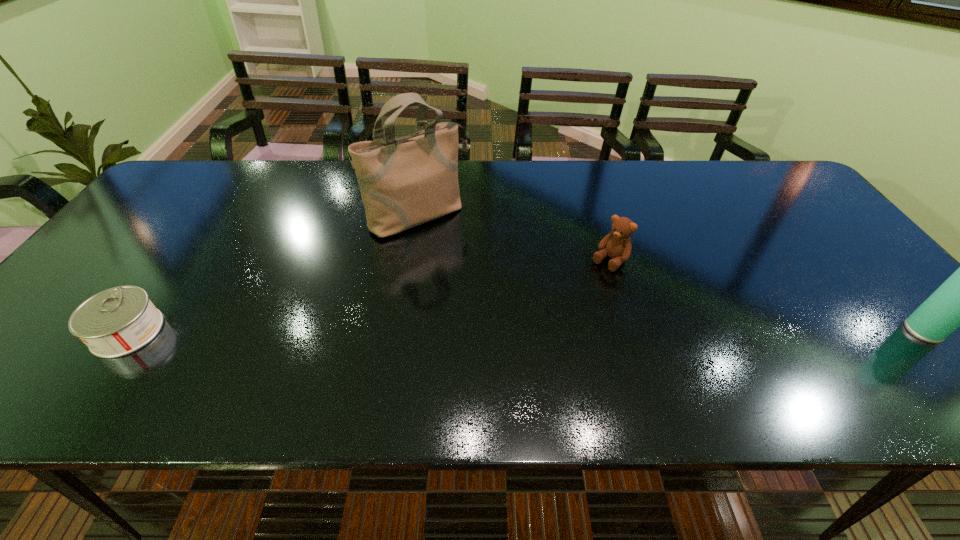
This screenshot has width=960, height=540. In order to click on can in this screenshot , I will do `click(118, 321)`.

You are a GUI agent. You are given a task and a screenshot of the screen. Output one action in this format:
    pyautogui.click(x=<x>, y=<y>)
    Task: Click on the leftmost object
    
    Given the screenshot: What is the action you would take?
    pyautogui.click(x=118, y=321)

In order to click on thermos bottle in this screenshot , I will do `click(959, 302)`.

The width and height of the screenshot is (960, 540). I want to click on the rightmost object, so click(x=959, y=302).

The height and width of the screenshot is (540, 960). I want to click on teddy bear, so click(617, 244).

Where is `the third object from left to right`? the third object from left to right is located at coordinates (617, 244).

Where is `the second object from left to right`? This screenshot has width=960, height=540. the second object from left to right is located at coordinates (404, 182).

At what (x,y) coordinates should I click in order to perform the action: click on the farthest object. Please return your answer as a coordinate pair (x, y). The width and height of the screenshot is (960, 540). Looking at the image, I should click on (404, 182).

Identify the location of free space located on the back of the shortest object. The image size is (960, 540). tap(182, 255).

Locate an element on the screen. The height and width of the screenshot is (540, 960). free space located on the left of the third shortest object is located at coordinates (794, 331).